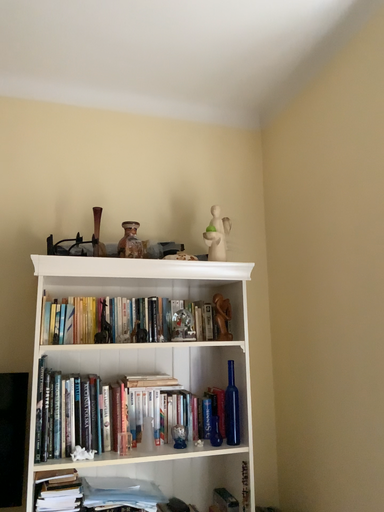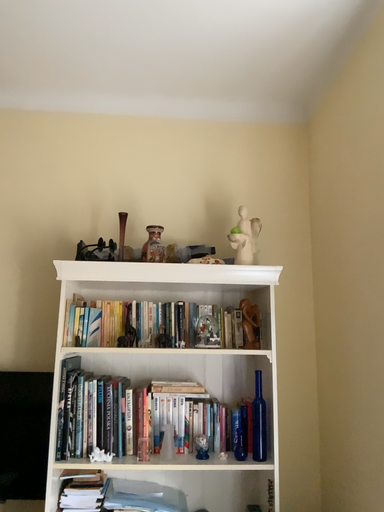
Question: How did the camera likely rotate when shooting the video?

Choices:
 (A) rotated left
 (B) rotated right

Answer: (A)